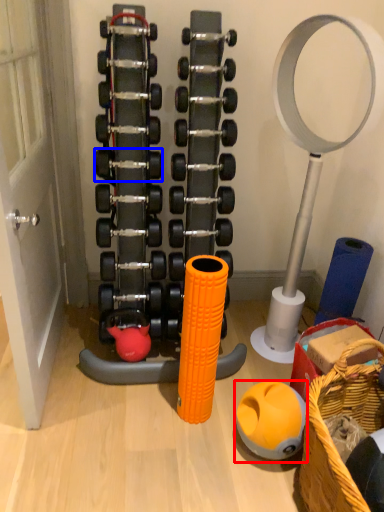
Question: Which point is closer to the camera, ball (highlighted by a red box) or dumbbell (highlighted by a blue box)?

Choices:
 (A) ball
 (B) dumbbell

Answer: (A)